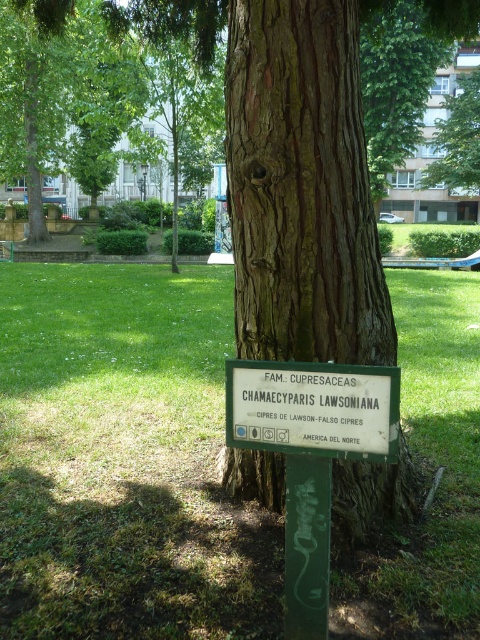
Is point (41, 364) more distant than point (339, 456)?

Yes, it is behind point (339, 456).

Can you confirm if green grass at center is wider than green plastic sign at center?

Indeed, green grass at center has a greater width compared to green plastic sign at center.

Which is in front, point (468, 337) or point (324, 380)?

Point (324, 380)

What are the coordinates of `green grass at center` in the screenshot? It's located at (123, 460).

Consider the image. Is green grass at center behind brown rough bark at center?

That is False.

I want to click on green grass at center, so click(123, 460).

Who is higher up, brown rough bark at center or green plastic sign at center?

brown rough bark at center

Does point (358, 301) come in front of point (276, 436)?

That is False.

Locate an element on the screen. This screenshot has width=480, height=640. brown rough bark at center is located at coordinates (301, 188).